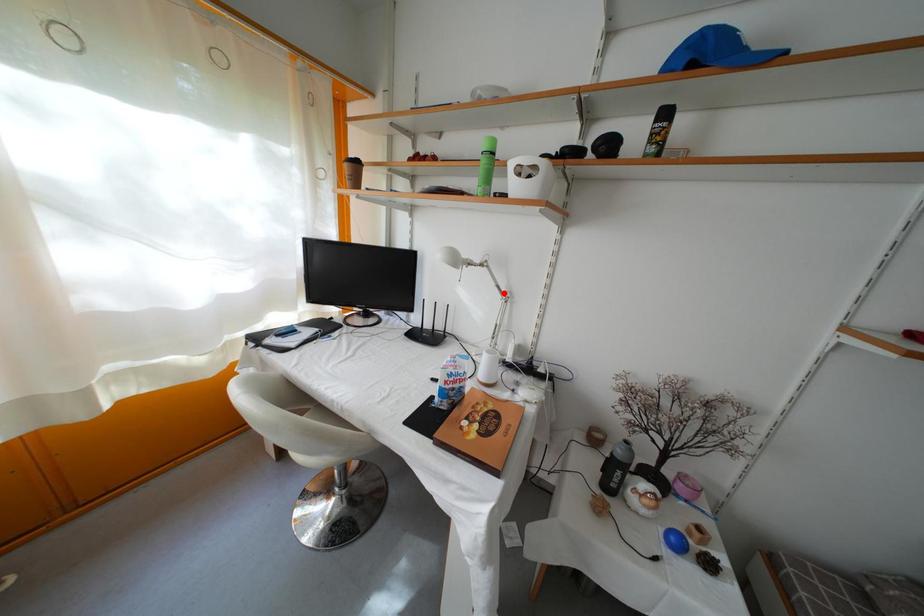
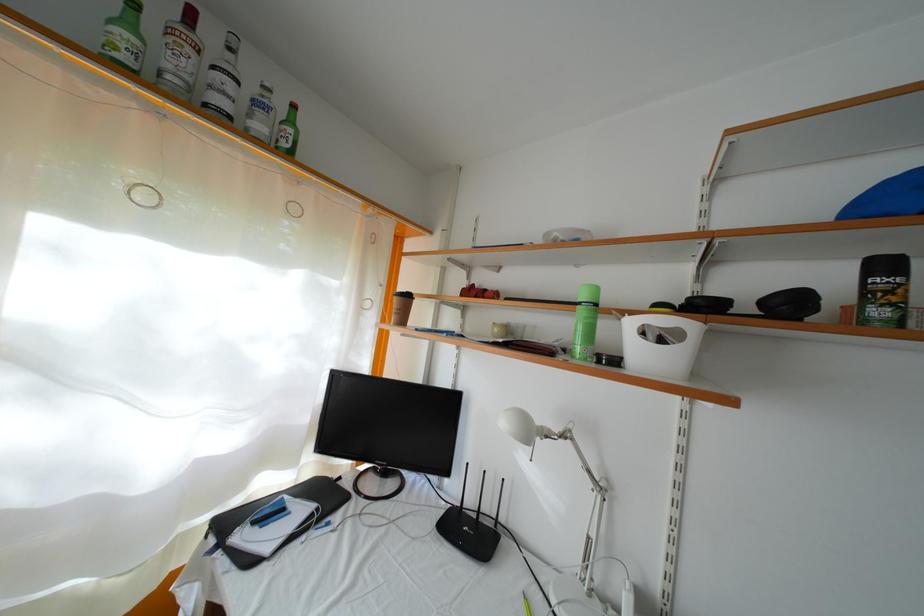
Locate, in the second image, the point that corresponds to the highlighted location in the first image.

(594, 477)